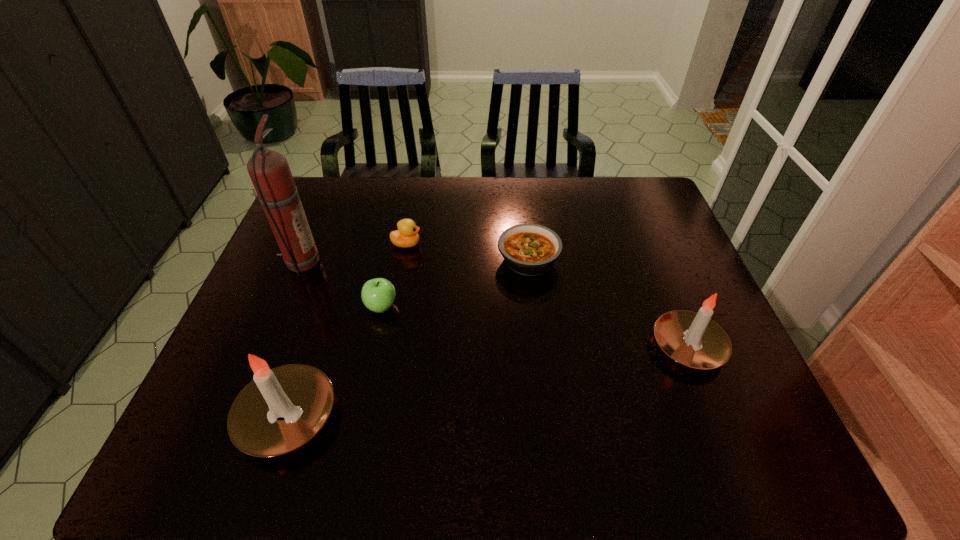
To achieve even spacing by inserting another candle among them, please point to a vacant spot for this new candle. Please provide its 2D coordinates. Your answer should be formatted as a tuple, i.e. [(x, y)], where the tuple contains the x and y coordinates of a point satisfying the conditions above.

[(500, 379)]